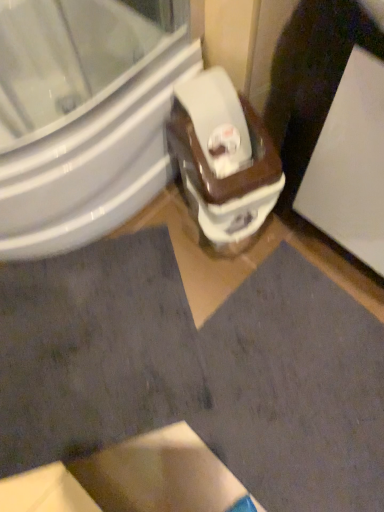
You are a GUI agent. You are given a task and a screenshot of the screen. Output one action in this format:
    pyautogui.click(x=<x>, y=<y>)
    Task: Click on the vacant space in dark gray fabric at lower left (from a real-world perspective)
    
    Given the screenshot: What is the action you would take?
    pyautogui.click(x=87, y=351)